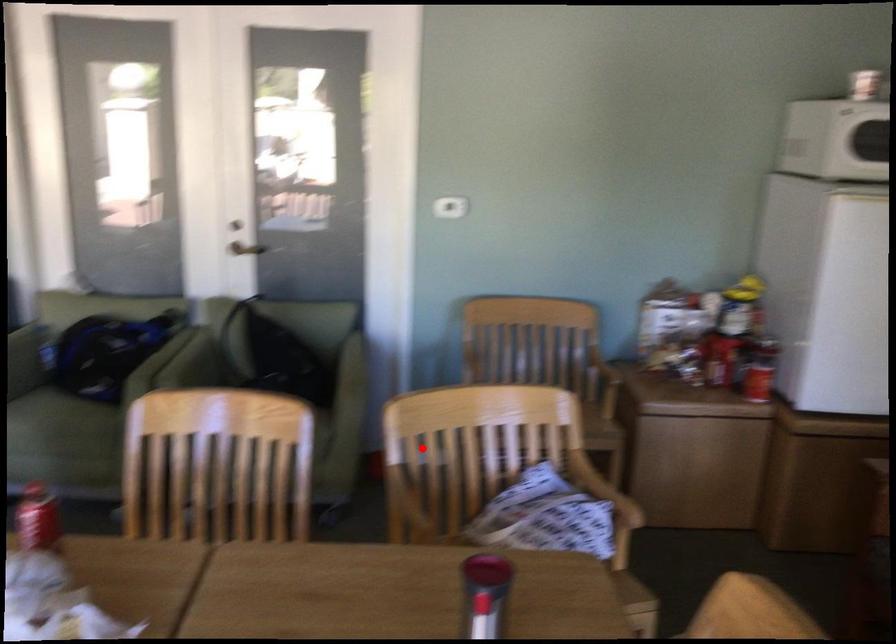
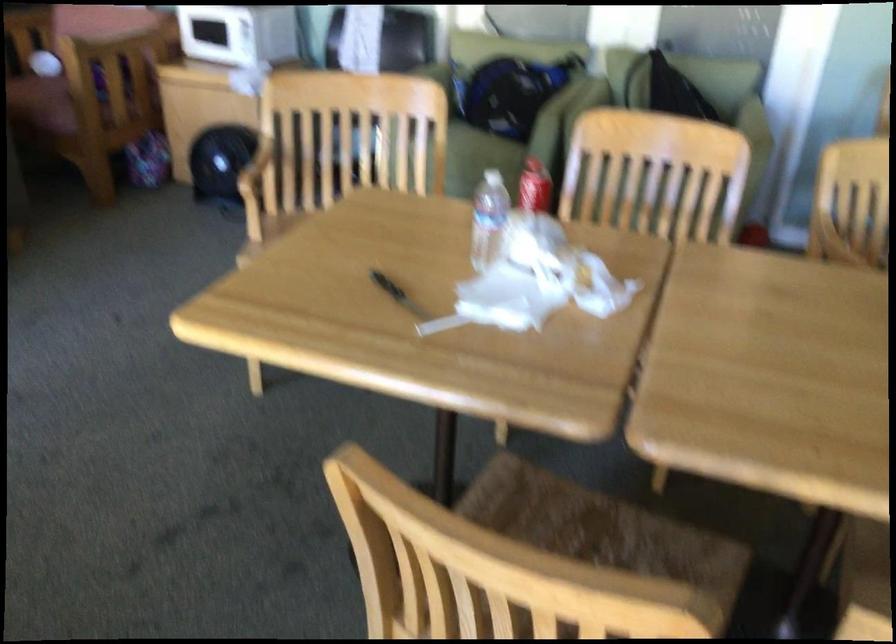
Question: I am providing you with two images of the same scene from different viewpoints. A red point is marked on the first image. Is the red point's position out of view in image 2?

Choices:
 (A) Yes
 (B) No

Answer: (B)